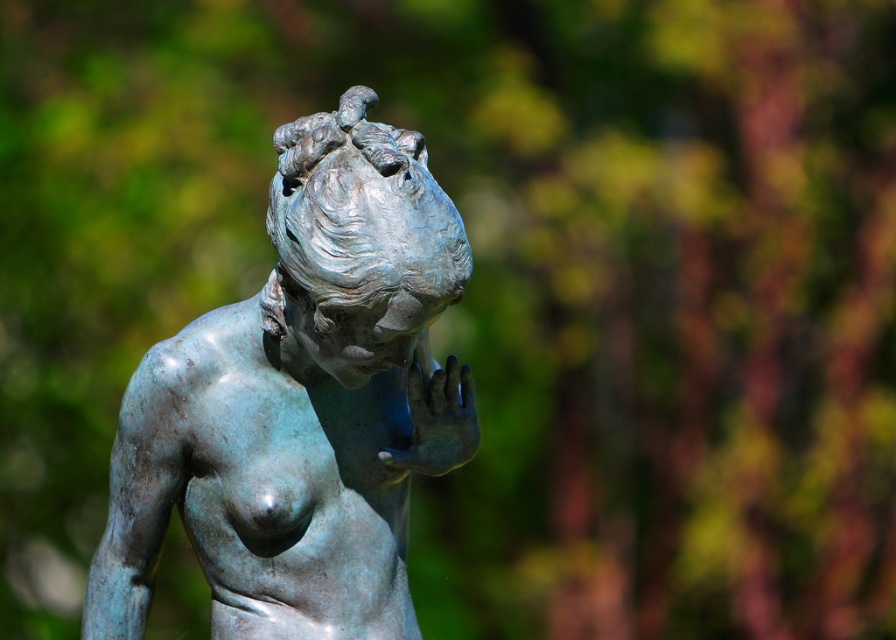
You are a photographer adjusting your camera to focus on two specific points on the statue. The first point is at coordinates point (248, 588) and the second is at point (461, 406). Which point should you focus on first if you want to ensure the closest part of the statue is sharp?

Point (248, 588) is closer to the camera than point (461, 406), so you should focus on point (248, 588) first to ensure the closest part of the statue is sharp.